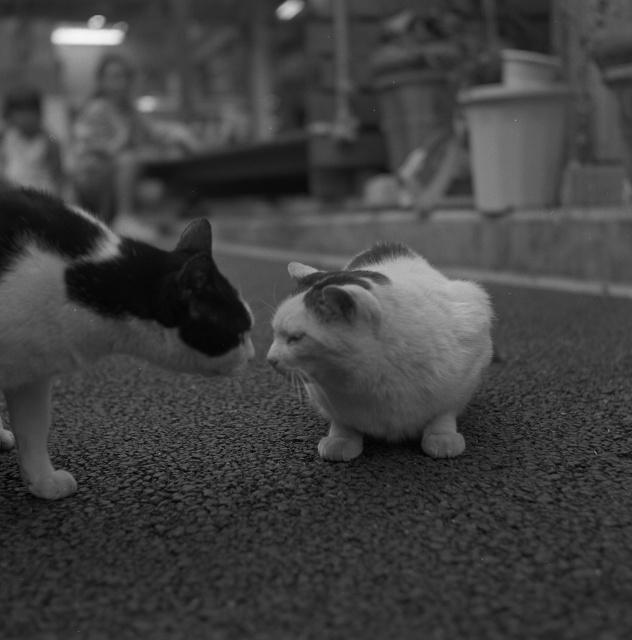
Can you confirm if black and white fur cat at left is shorter than fluffy white cat at center?

No.

This screenshot has height=640, width=632. In order to click on black and white fur cat at left in this screenshot , I will do `click(99, 312)`.

Is point (49, 461) behind point (367, 364)?

No, (49, 461) is in front of (367, 364).

This screenshot has height=640, width=632. In order to click on black and white fur cat at left in this screenshot , I will do `click(99, 312)`.